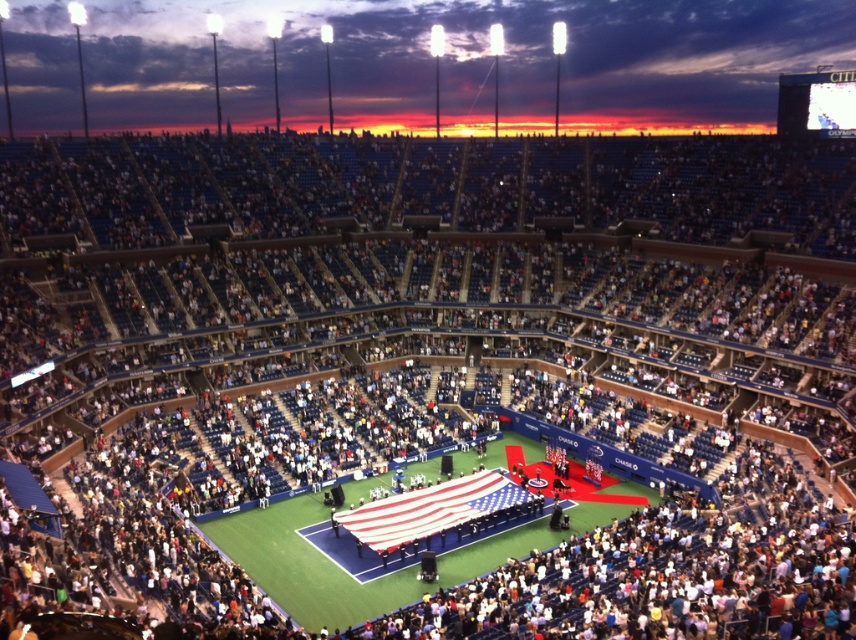
Which of these two, green artificial turf at center or american flag at center, stands taller?

Standing taller between the two is green artificial turf at center.

Between point (370, 584) and point (409, 536), which one is positioned in front?

Point (370, 584) is in front.

Where is `green artificial turf at center`? The width and height of the screenshot is (856, 640). green artificial turf at center is located at coordinates (302, 564).